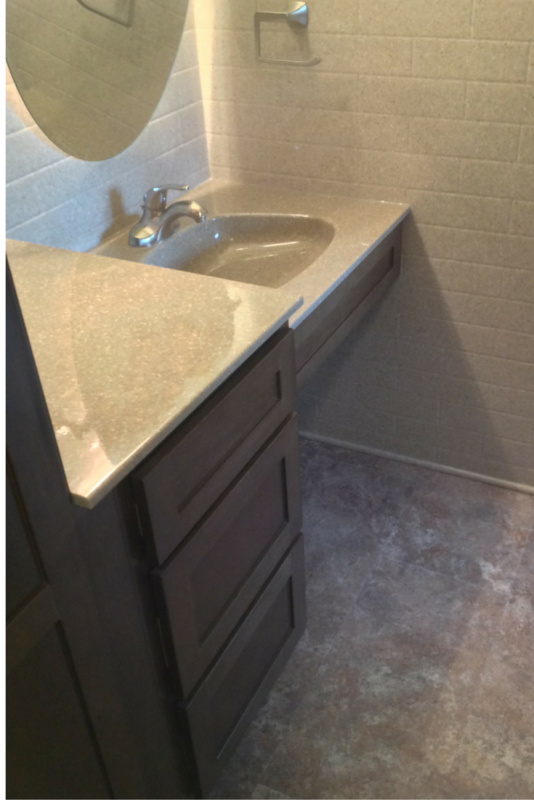
You are a GUI agent. You are given a task and a screenshot of the screen. Output one action in this format:
    pyautogui.click(x=<x>, y=<y>)
    Task: Click on the drawers
    The width and height of the screenshot is (534, 800).
    Given the screenshot: What is the action you would take?
    pyautogui.click(x=171, y=528), pyautogui.click(x=194, y=609), pyautogui.click(x=206, y=718)